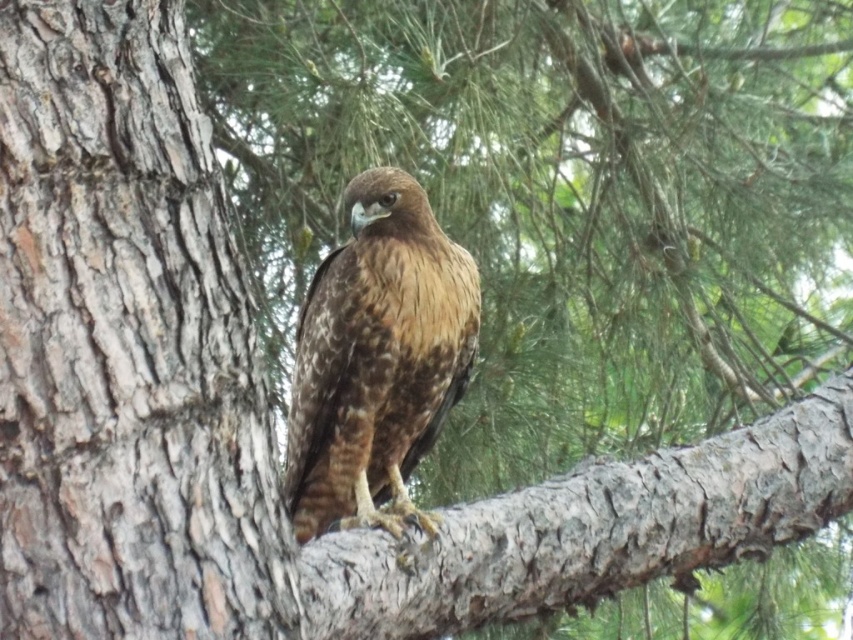
From the picture: Is smooth bark branch at center to the right of brown speckled feathers at center from the viewer's perspective?

Indeed, smooth bark branch at center is positioned on the right side of brown speckled feathers at center.

Is point (686, 492) more distant than point (332, 301)?

No, it is not.

Is point (708, 564) behind point (358, 456)?

No.

The height and width of the screenshot is (640, 853). I want to click on smooth bark branch at center, so click(590, 529).

Is smooth bark tree trunk at center closer to the viewer compared to smooth bark branch at center?

Yes, it is.

Is point (231, 428) farther from viewer compared to point (508, 563)?

No.

Locate an element on the screen. This screenshot has width=853, height=640. smooth bark tree trunk at center is located at coordinates (125, 346).

Which of these two, smooth bark tree trunk at center or brown speckled feathers at center, stands shorter?

Standing shorter between the two is brown speckled feathers at center.

Between smooth bark tree trunk at center and brown speckled feathers at center, which one is positioned lower?

brown speckled feathers at center is lower down.

Locate an element on the screen. This screenshot has width=853, height=640. smooth bark tree trunk at center is located at coordinates (125, 346).